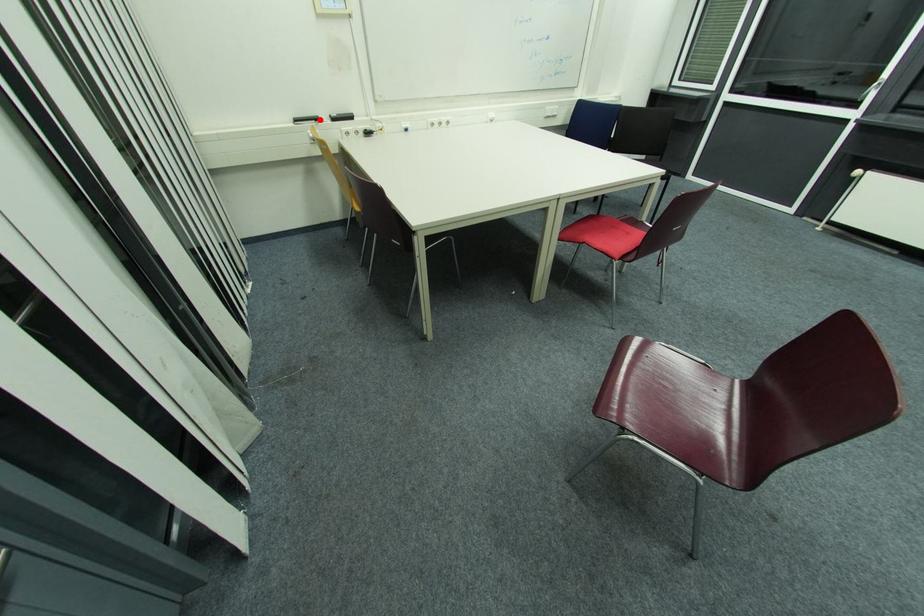
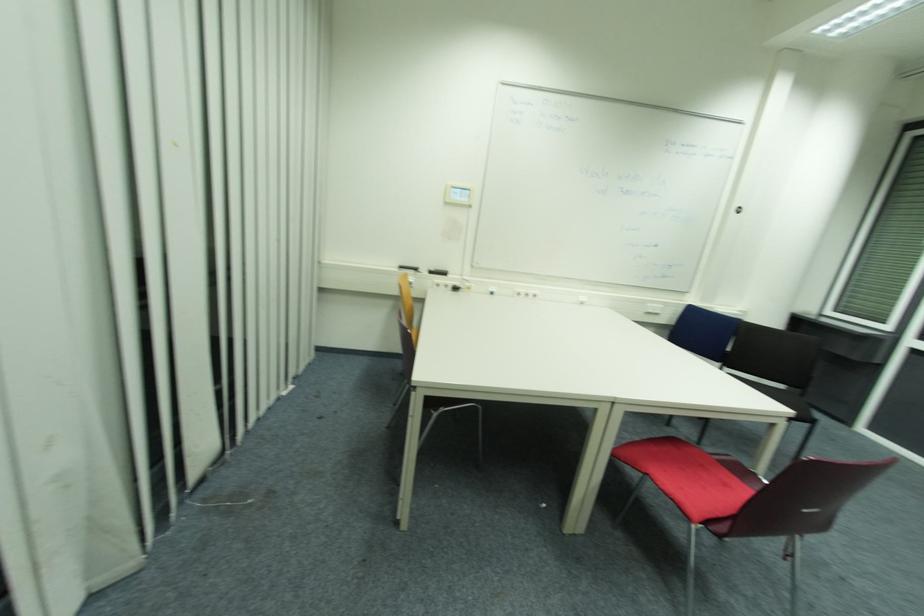
The point at the highlighted location is marked in the first image. Where is the corresponding point in the second image?

(419, 270)